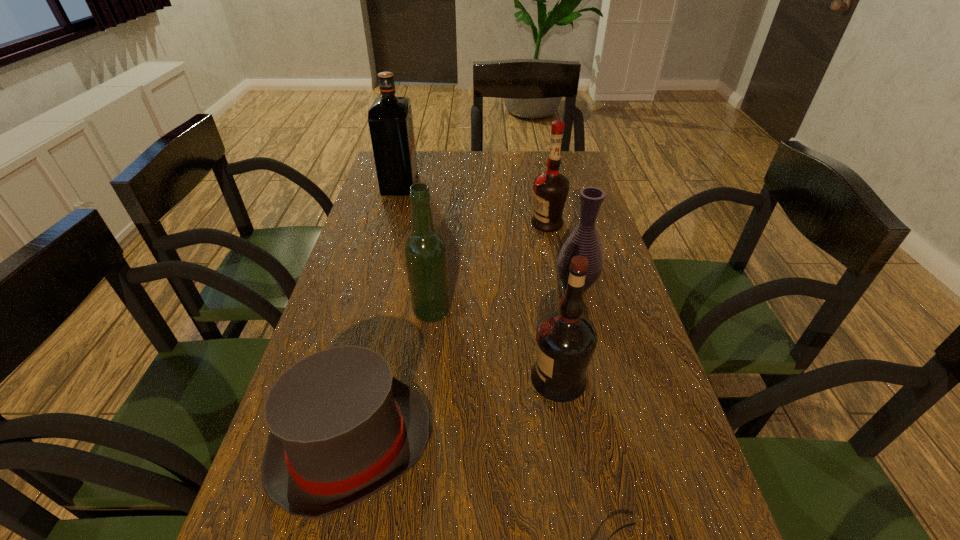
The image size is (960, 540). What are the coordinates of `free space located on the front and back of the sixth nearest object` in the screenshot? It's located at tap(423, 224).

Where is `vacant space situated on the front and back of the sixth nearest object`? The height and width of the screenshot is (540, 960). vacant space situated on the front and back of the sixth nearest object is located at coordinates (480, 224).

The height and width of the screenshot is (540, 960). In order to click on free space located 0.260m on the surface of the nearest liquor in this screenshot , I will do `click(403, 379)`.

Find the location of a particular element. This screenshot has height=540, width=960. vacant space located 0.260m on the surface of the nearest liquor is located at coordinates (403, 379).

Where is `free space located on the surface of the nearest liquor`? free space located on the surface of the nearest liquor is located at coordinates (457, 379).

The image size is (960, 540). I want to click on vacant space located 0.160m on the front of the fifth tallest object, so click(x=592, y=352).

Find the location of a particular element. The width and height of the screenshot is (960, 540). free space located 0.270m on the right of the dress hat is located at coordinates (580, 445).

What are the coordinates of `object that is at the far edge` in the screenshot? It's located at (390, 120).

Where is `liquor that is at the left edge`? The width and height of the screenshot is (960, 540). liquor that is at the left edge is located at coordinates (390, 120).

Where is `dress hat located at the left edge`? The height and width of the screenshot is (540, 960). dress hat located at the left edge is located at coordinates (342, 427).